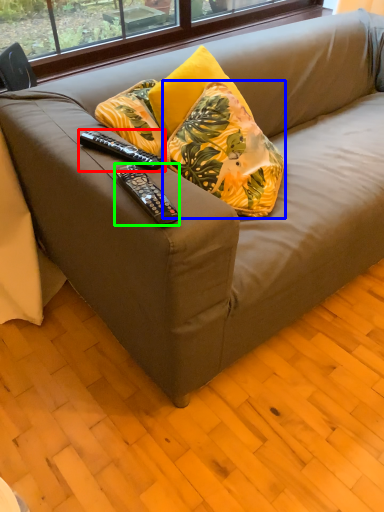
Question: Which is farther away from remote control (highlighted by a red box)? pillow (highlighted by a blue box) or remote control (highlighted by a green box)?

Choices:
 (A) pillow
 (B) remote control

Answer: (A)